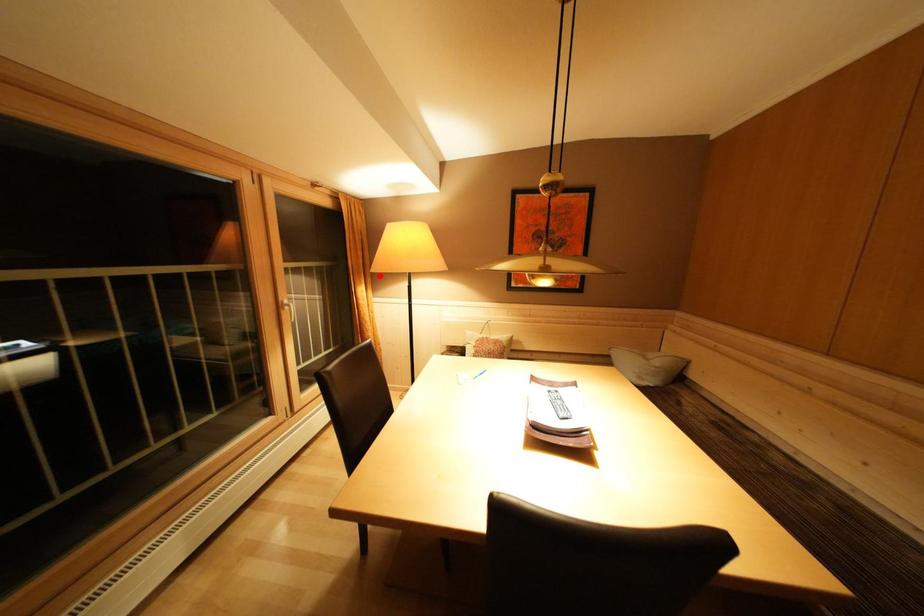
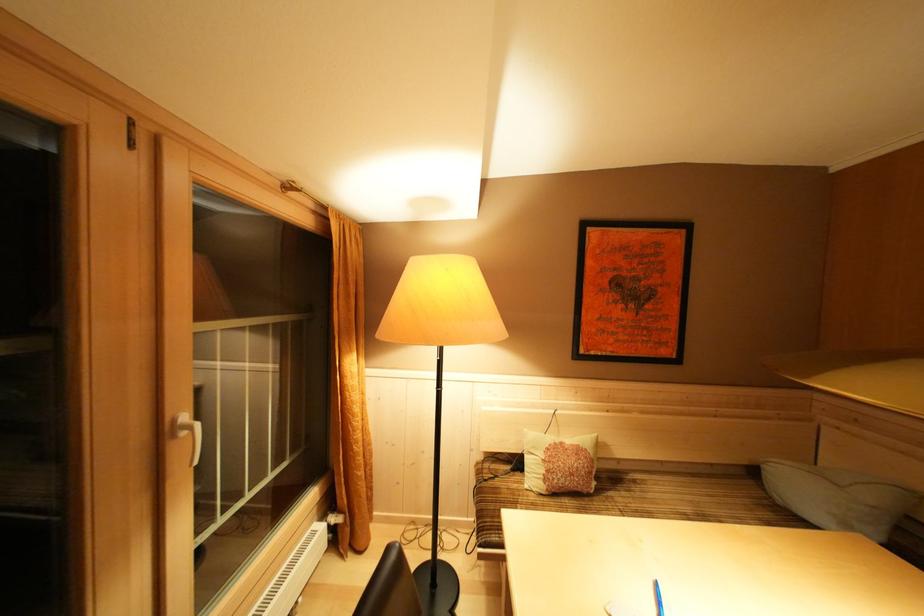
Find the pixel in the second image that matches the highlighted location in the first image.

(385, 339)